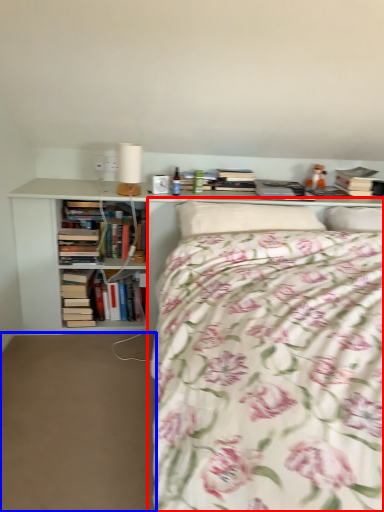
Question: Among these objects, which one is farthest to the camera, bed (highlighted by a red box) or plain (highlighted by a blue box)?

Choices:
 (A) bed
 (B) plain

Answer: (B)